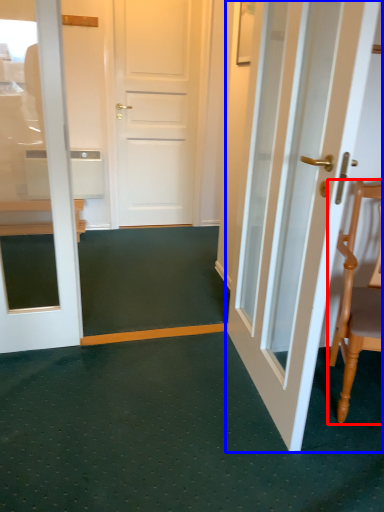
Question: Which of the following is the closest to the observer, chair (highlighted by a red box) or door (highlighted by a blue box)?

Choices:
 (A) chair
 (B) door

Answer: (B)